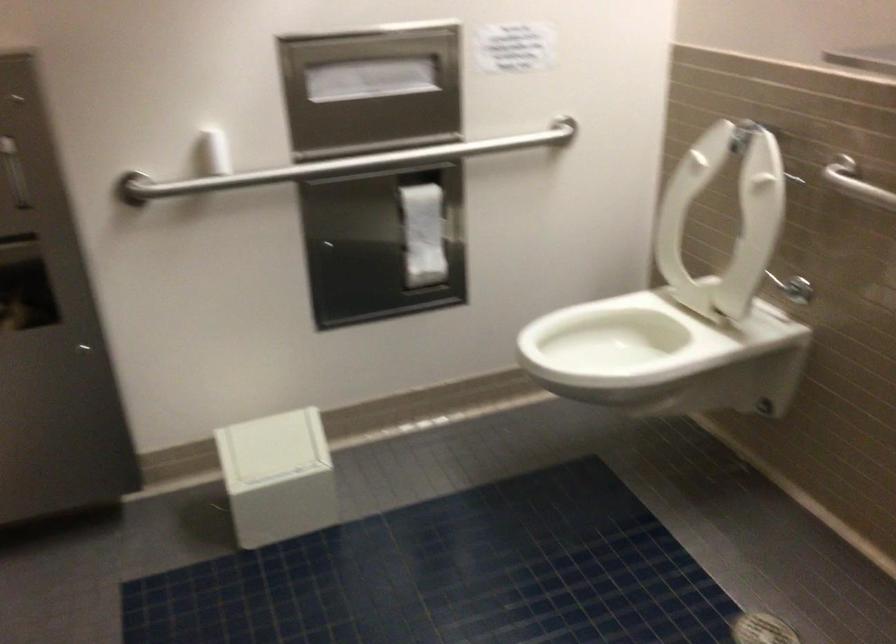
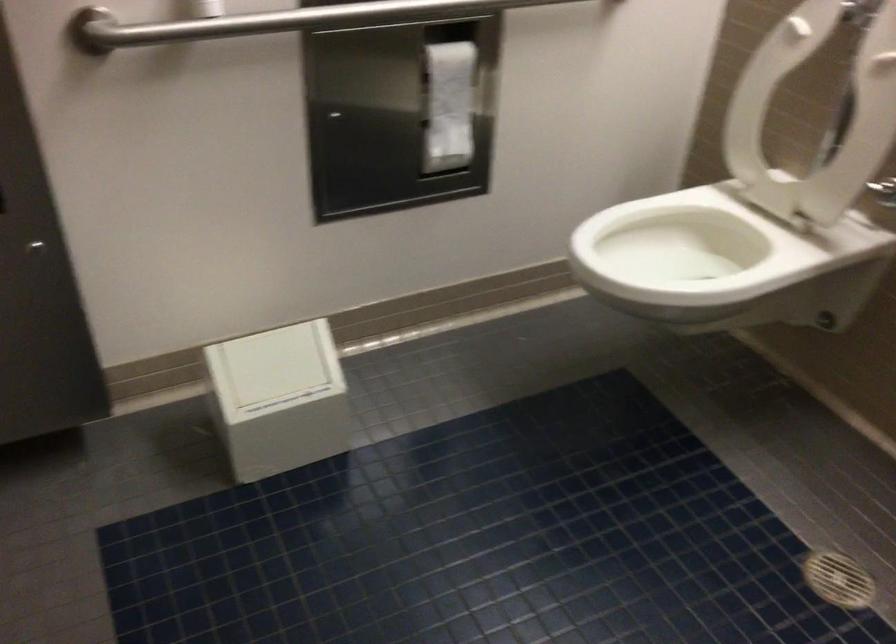
Locate, in the second image, the point that corresponds to point (273, 474) in the first image.

(279, 399)